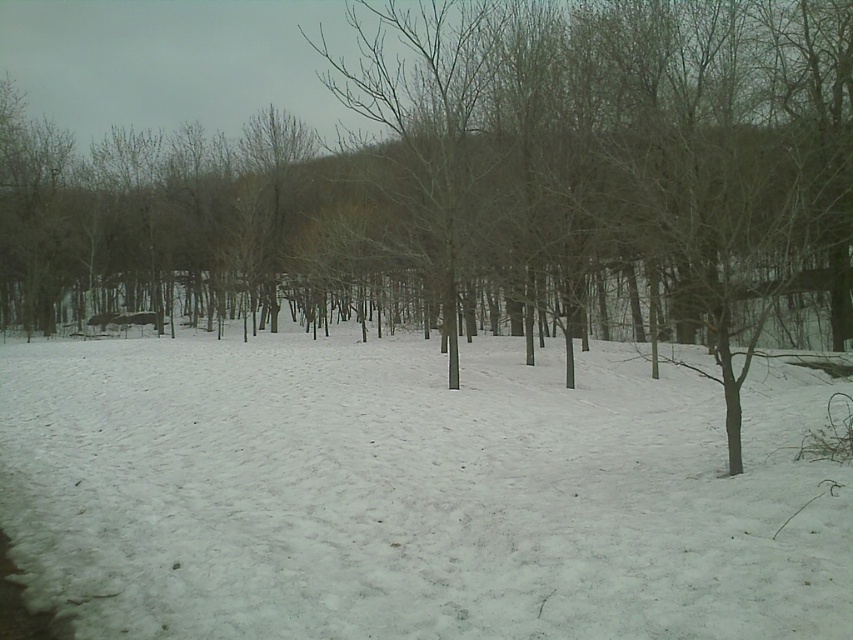
You are standing in the snowy field and want to reach both the point at coordinates (350, 444) and the point at (775, 0). Which point will you reach first if you start walking towards them?

You will reach the point at coordinates (350, 444) first because it is closer to you than the point at (775, 0).

Looking at this image, you are standing at the bottom left corner of the snowy field where the faint tracks are. You want to walk straight towards the center of the image. Will you step on the white fluffy snow at center?

Yes, because the white fluffy snow at center is located at point (413, 493), which is along the straight path from the bottom left corner to the center of the image.